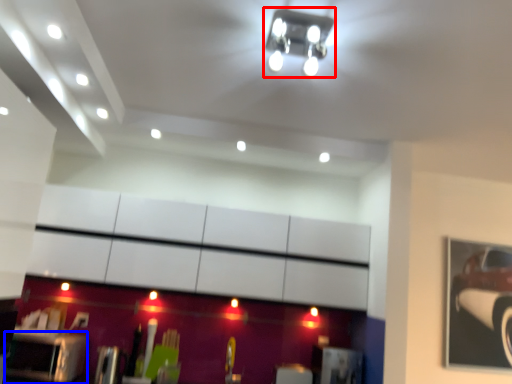
Question: Which of the following is the farthest to the observer, light fixture (highlighted by a red box) or furniture (highlighted by a blue box)?

Choices:
 (A) light fixture
 (B) furniture

Answer: (B)